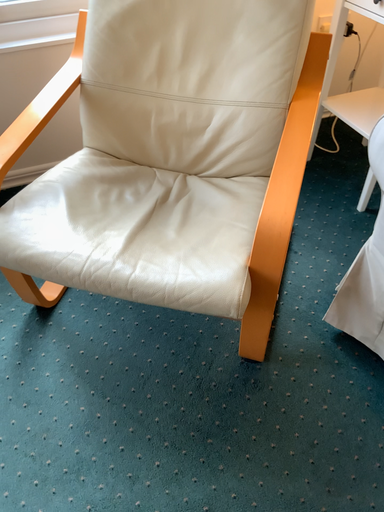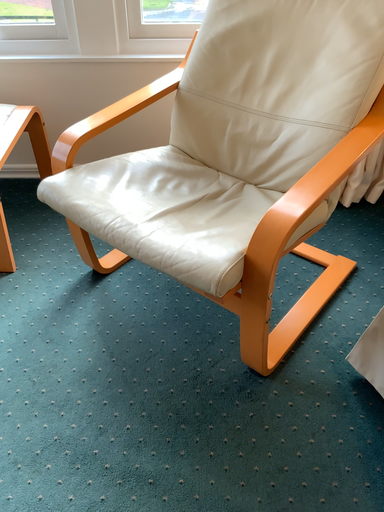
Question: How did the camera likely rotate when shooting the video?

Choices:
 (A) rotated left
 (B) rotated right

Answer: (A)